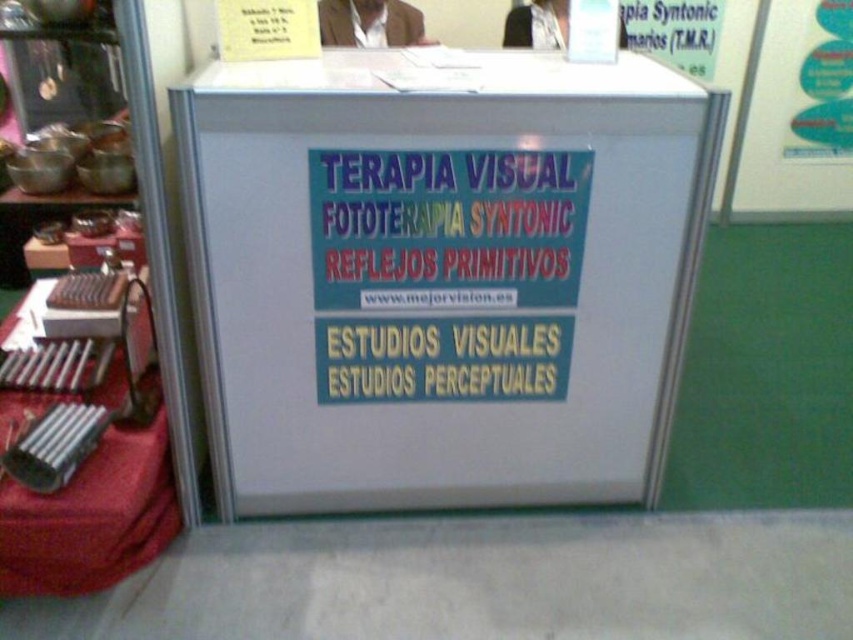
Question: Where is white metallic sign at center located in relation to metallic silver table at lower left in the image?

Choices:
 (A) left
 (B) right

Answer: (B)

Question: Does white metallic sign at center appear over white paper at upper right?

Choices:
 (A) no
 (B) yes

Answer: (A)

Question: Which point appears closest to the camera in this image?

Choices:
 (A) pyautogui.click(x=10, y=436)
 (B) pyautogui.click(x=380, y=280)
 (C) pyautogui.click(x=758, y=173)

Answer: (A)

Question: Is white metallic sign at center above white paper at upper right?

Choices:
 (A) yes
 (B) no

Answer: (B)

Question: Considering the real-world distances, which object is farthest from the white paper at upper right?

Choices:
 (A) white metallic sign at center
 (B) metallic silver table at lower left

Answer: (B)

Question: Which is nearer to the white metallic sign at center?

Choices:
 (A) metallic silver table at lower left
 (B) white paper at upper right

Answer: (A)